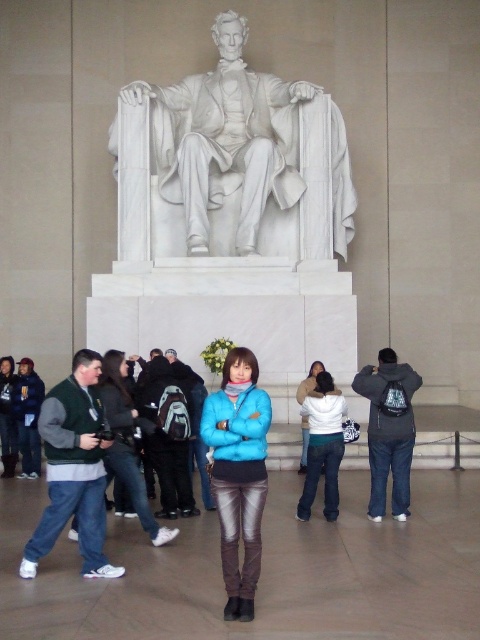
Question: Does dark gray backpack at center appear on the right side of green fleece jacket at center?

Choices:
 (A) no
 (B) yes

Answer: (B)

Question: Which point is closer to the camera?

Choices:
 (A) white fleece jacket at center
 (B) dark green sweater at left

Answer: (A)

Question: Which point is closer to the camera?

Choices:
 (A) white marble statue at center
 (B) white fleece jacket at center
 (C) green fleece jacket at center
 (D) dark gray backpack at center

Answer: (D)

Question: Does blue matte jacket at center have a lesser width compared to green fleece jacket at center?

Choices:
 (A) yes
 (B) no

Answer: (A)

Question: Can you confirm if blue matte jacket at center is positioned above dark green sweater at left?

Choices:
 (A) yes
 (B) no

Answer: (B)

Question: Based on their relative distances, which object is nearer to the dark green sweater at left?

Choices:
 (A) dark gray backpack at center
 (B) white marble statue at center
 (C) blue matte jacket at center
 (D) green fleece jacket at center

Answer: (D)